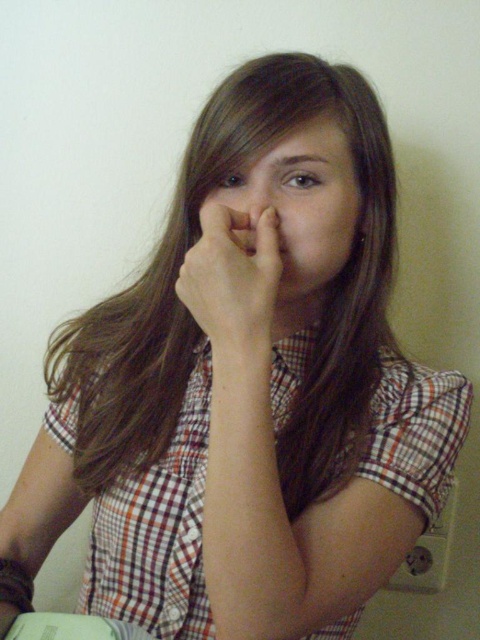
Question: From the image, what is the correct spatial relationship of plaid cotton shirt at center in relation to matte skin nose at center?

Choices:
 (A) left
 (B) right

Answer: (A)

Question: Can you confirm if smooth skin hand at center is positioned below smooth flesh nose at center?

Choices:
 (A) yes
 (B) no

Answer: (A)

Question: Which point appears closest to the camera in this image?

Choices:
 (A) (291, 188)
 (B) (447, 372)
 (C) (202, 307)

Answer: (C)

Question: Which of the following is the farthest from the observer?

Choices:
 (A) (228, 220)
 (B) (256, 266)

Answer: (A)

Question: Which point is farther to the camera?

Choices:
 (A) (248, 182)
 (B) (243, 262)
 (C) (224, 198)
 (D) (433, 438)

Answer: (C)

Question: Does matte skin nose at center appear under smooth skin hand at center?

Choices:
 (A) no
 (B) yes

Answer: (A)